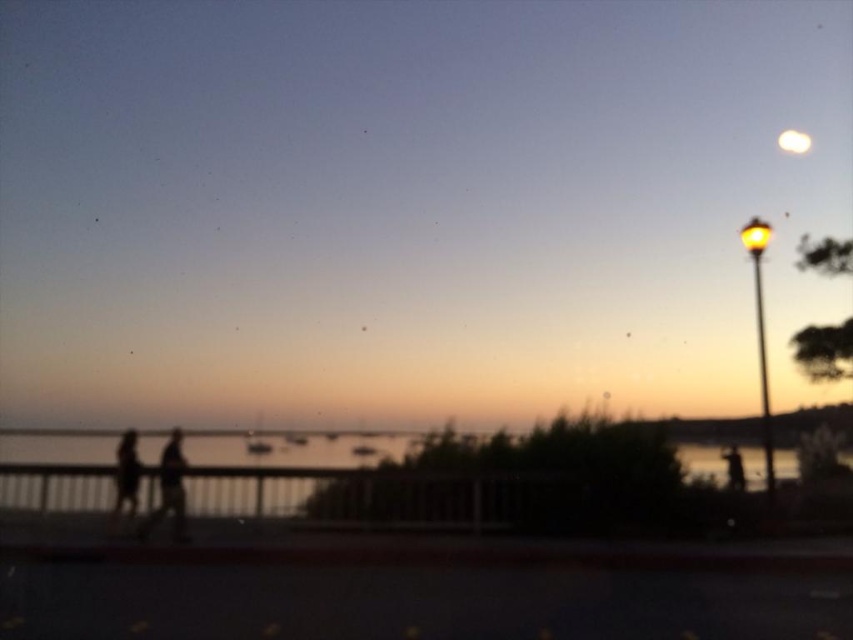
Question: Which point is closer to the camera taking this photo?

Choices:
 (A) (798, 145)
 (B) (730, 461)
 (C) (170, 500)
 (D) (119, 490)

Answer: (C)

Question: Which point is closer to the camera?

Choices:
 (A) (144, 534)
 (B) (734, 483)
 (C) (788, 138)

Answer: (A)

Question: Is silhouette figure at left to the right of white glossy moon at upper right from the viewer's perspective?

Choices:
 (A) yes
 (B) no

Answer: (B)

Question: Can you confirm if silhouette figure at left is positioned below silhouette figure at right?

Choices:
 (A) no
 (B) yes

Answer: (A)

Question: Among these objects, which one is nearest to the camera?

Choices:
 (A) silhouette figure at left
 (B) silhouette figures at center

Answer: (B)

Question: Is silhouette figures at center smaller than silhouette figure at right?

Choices:
 (A) yes
 (B) no

Answer: (B)